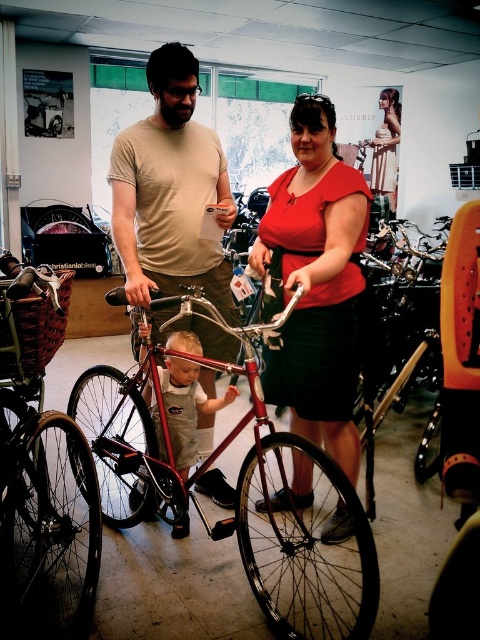
You are a customer in the bicycle shop and want to try on the light brown denim overalls at center. Can you step forward to put them on without moving the matte black bicycle at center?

The matte black bicycle at center is positioned over light brown denim overalls at center, which means the bicycle is blocking access to the overalls. You would need to move the bicycle first to reach the overalls.

You are a customer in the bicycle shop and see the matte red blouse at center and the matte black bicycle at center. Which object is positioned higher in the image?

The matte red blouse at center is located above the matte black bicycle at center, so it is positioned higher in the image.

Based on the photo, what is located at the coordinates point (43, 480)?

The matte black bicycle at center is located at point (43, 480).